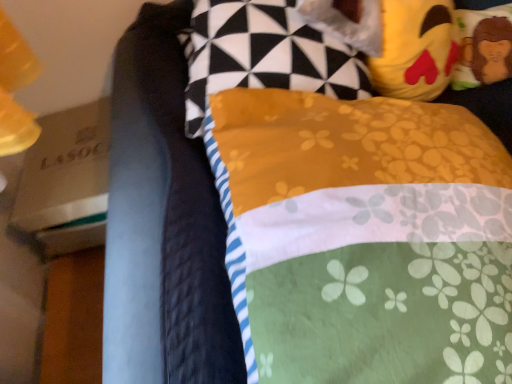
Question: From the image's perspective, is yellow plush toy at upper right over yellow plush toy at upper right, which appears as the 3th pillow when viewed from the left?

Choices:
 (A) yes
 (B) no

Answer: (B)

Question: From a real-world perspective, is yellow plush toy at upper right on yellow plush toy at upper right, which appears as the 3th pillow when viewed from the left?

Choices:
 (A) yes
 (B) no

Answer: (A)

Question: Does yellow plush toy at upper right have a larger size compared to yellow plush toy at upper right, the 1th pillow when ordered from right to left?

Choices:
 (A) yes
 (B) no

Answer: (A)

Question: Considering the relative sizes of yellow plush toy at upper right and yellow plush toy at upper right, the 1th pillow when ordered from right to left, in the image provided, is yellow plush toy at upper right shorter than yellow plush toy at upper right, the 1th pillow when ordered from right to left,?

Choices:
 (A) yes
 (B) no

Answer: (B)

Question: Is the position of yellow plush toy at upper right more distant than that of yellow plush toy at upper right, the 1th pillow when ordered from right to left?

Choices:
 (A) no
 (B) yes

Answer: (A)

Question: Is yellow plush toy at upper right aimed at yellow plush toy at upper right, the 1th pillow when ordered from right to left?

Choices:
 (A) yes
 (B) no

Answer: (B)

Question: Could you tell me if yellow plush toy at upper right is facing yellow fabric pillow at upper right, which is counted as the 2th pillow, starting from the right?

Choices:
 (A) yes
 (B) no

Answer: (A)

Question: From the image's perspective, is yellow plush toy at upper right beneath yellow fabric pillow at upper right, which is counted as the 2th pillow, starting from the right?

Choices:
 (A) yes
 (B) no

Answer: (B)

Question: Are yellow plush toy at upper right and yellow fabric pillow at upper right, which is counted as the 2th pillow, starting from the right, located far from each other?

Choices:
 (A) no
 (B) yes

Answer: (A)

Question: Does yellow plush toy at upper right have a lesser height compared to yellow fabric pillow at upper right, the 2th pillow when ordered from left to right?

Choices:
 (A) no
 (B) yes

Answer: (B)

Question: Considering the relative sizes of yellow plush toy at upper right and yellow fabric pillow at upper right, which is counted as the 2th pillow, starting from the right, in the image provided, is yellow plush toy at upper right taller than yellow fabric pillow at upper right, which is counted as the 2th pillow, starting from the right,?

Choices:
 (A) no
 (B) yes

Answer: (A)

Question: From the image's perspective, would you say yellow plush toy at upper right is positioned over yellow fabric pillow at upper right, the 2th pillow when ordered from left to right?

Choices:
 (A) no
 (B) yes

Answer: (B)

Question: Would you say yellow fabric pillow at upper center, the 1th pillow when ordered from left to right, is outside yellow plush toy at upper right?

Choices:
 (A) no
 (B) yes

Answer: (B)